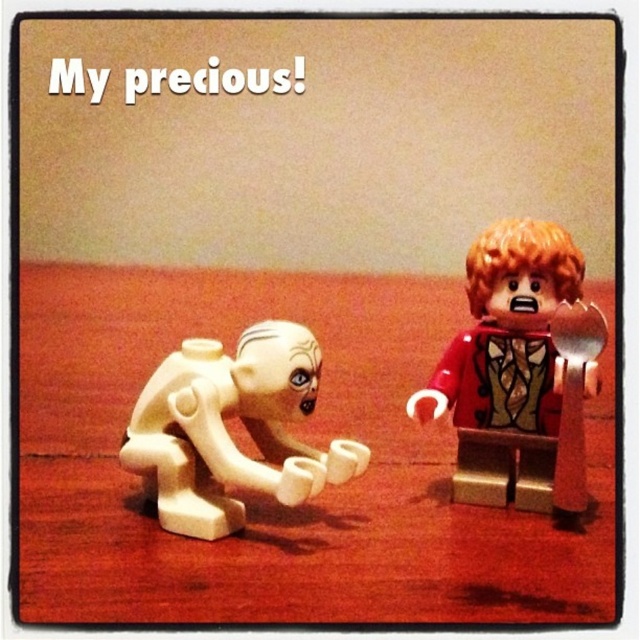
You are placing a small LEGO figure on a wooden table at center and a white matte figure at lower left. Which object is more to the right?

The wooden table at center is positioned on the right side of the white matte figure at lower left, so the wooden table at center is more to the right.